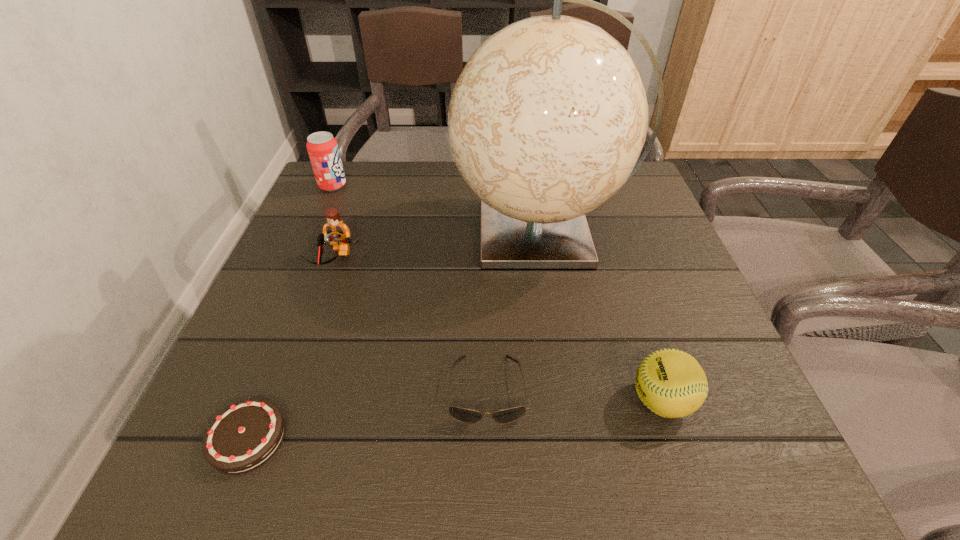
Image resolution: width=960 pixels, height=540 pixels. What are the coordinates of `the tallest object` in the screenshot? It's located at (546, 122).

The height and width of the screenshot is (540, 960). I want to click on the second tallest object, so click(322, 147).

This screenshot has height=540, width=960. Find the location of `Lego`. Lego is located at coordinates (336, 233).

Locate an element on the screen. The width and height of the screenshot is (960, 540). softball is located at coordinates (671, 383).

The width and height of the screenshot is (960, 540). I want to click on sunglasses, so (x=469, y=416).

This screenshot has height=540, width=960. Identify the location of chocolate cake. (247, 434).

I want to click on free region located 0.330m on the surface of the globe showing Europe and Africa, so click(308, 233).

Image resolution: width=960 pixels, height=540 pixels. I want to click on vacant space situated 0.240m on the surface of the globe showing Europe and Africa, so coord(348,233).

What are the coordinates of `blank space located on the surface of the globe showing Europe and Africa` in the screenshot? It's located at (383, 233).

The image size is (960, 540). Find the location of `free space located on the surface of the fifth shortest object`. free space located on the surface of the fifth shortest object is located at coordinates (485, 186).